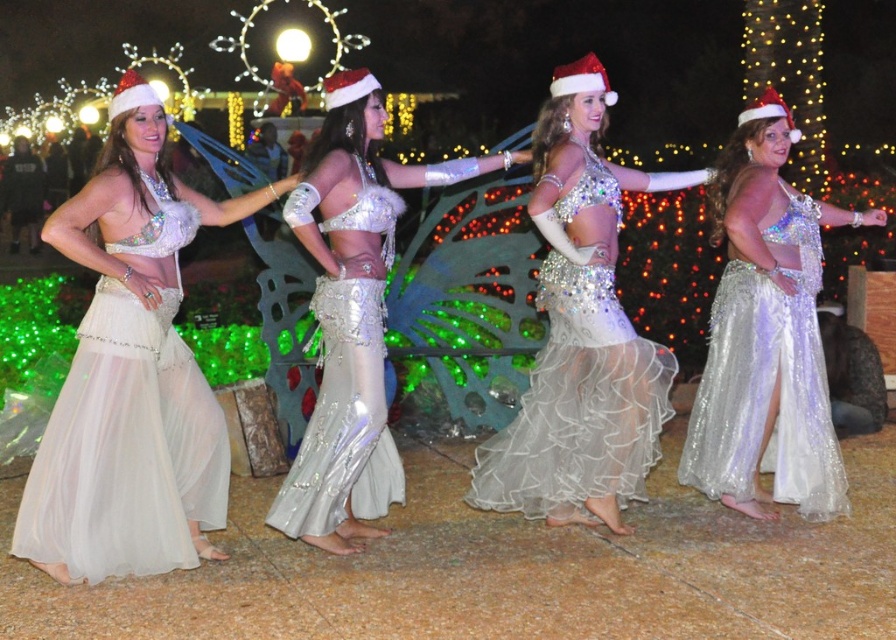
Between shimmering sequined skirt at center and shiny silver skirt at center, which one is positioned lower?

shiny silver skirt at center is lower down.

Between shimmering sequined skirt at center and shiny silver skirt at center, which one is positioned higher?

shimmering sequined skirt at center

Does point (560, 508) come closer to viewer compared to point (365, 227)?

No, (560, 508) is further to viewer.

You are a GUI agent. You are given a task and a screenshot of the screen. Output one action in this format:
    pyautogui.click(x=<x>, y=<y>)
    Task: Click on the shimmering sequined skirt at center
    The height and width of the screenshot is (640, 896).
    Given the screenshot: What is the action you would take?
    pyautogui.click(x=578, y=404)

Who is positioned more to the left, shiny silver skirt at right or shiny silver belly dancer at center?

shiny silver belly dancer at center

What do you see at coordinates (765, 333) in the screenshot?
I see `shiny silver skirt at right` at bounding box center [765, 333].

Is point (730, 333) in front of point (352, 531)?

No, it is not.

Identify the location of shiny silver skirt at right. (765, 333).

Can you confirm if matte silver belly dancer at left is positioned to the right of shiny silver belly dancer at center?

No, matte silver belly dancer at left is not to the right of shiny silver belly dancer at center.

Is point (54, 480) farther from viewer compared to point (369, 380)?

That is False.

Locate an element on the screen. The height and width of the screenshot is (640, 896). matte silver belly dancer at left is located at coordinates (131, 372).